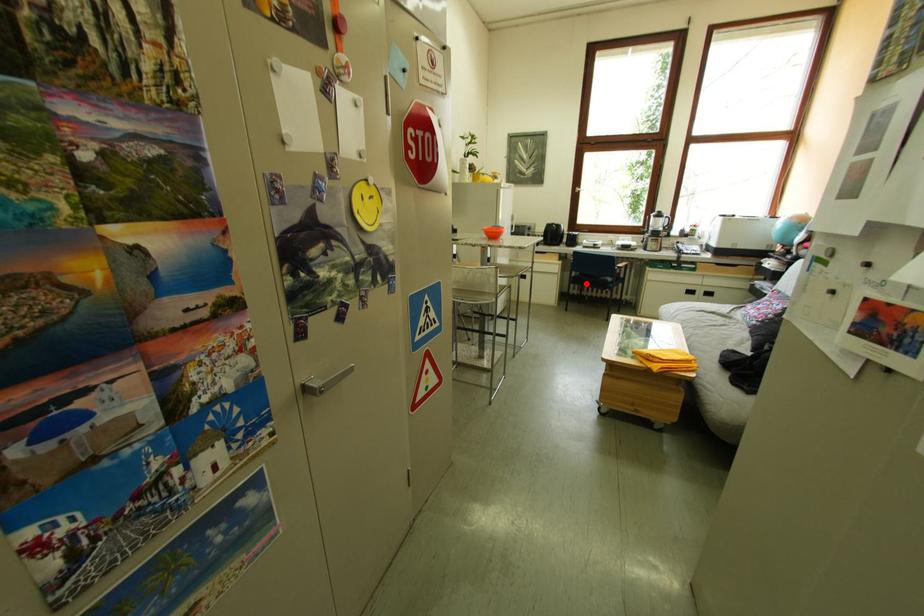
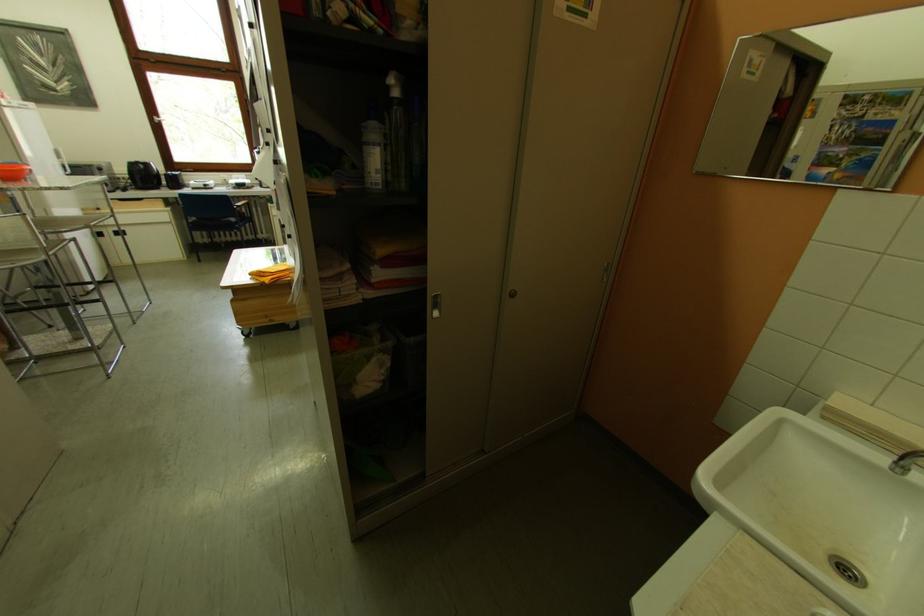
Question: I am providing you with two images of the same scene from different viewpoints. In image1, a red point is highlighted. Considering the same 3D point in image2, which of the following is correct?

Choices:
 (A) It is closer
 (B) It is farther

Answer: (B)